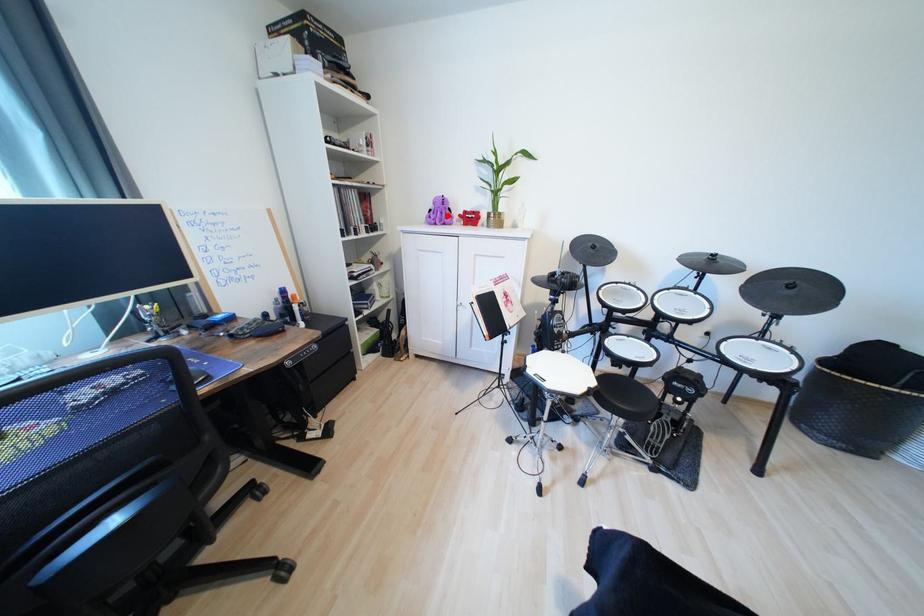
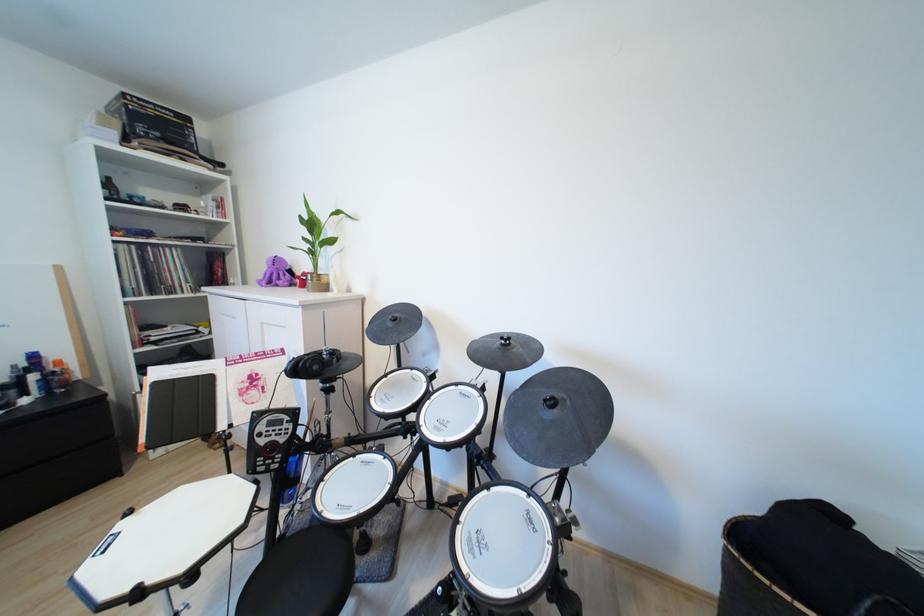
Where in the second image is the point corresponding to the highlighted location from the first image?

(289, 277)